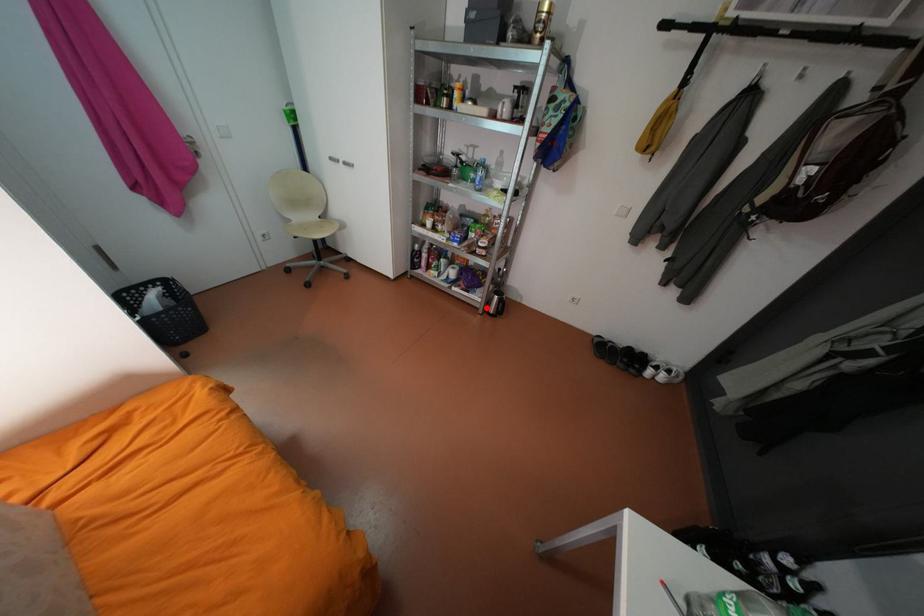
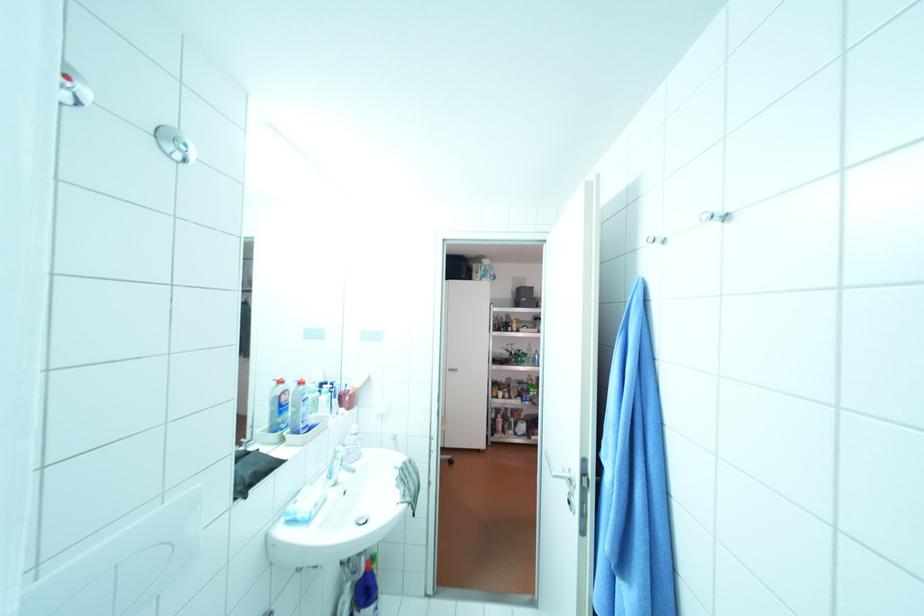
Question: I am providing you with two images of the same scene from different viewpoints. A red point is marked on the first image. At the location where the point appears in image 1, is it still visible in image 2?

Choices:
 (A) Yes
 (B) No

Answer: (B)